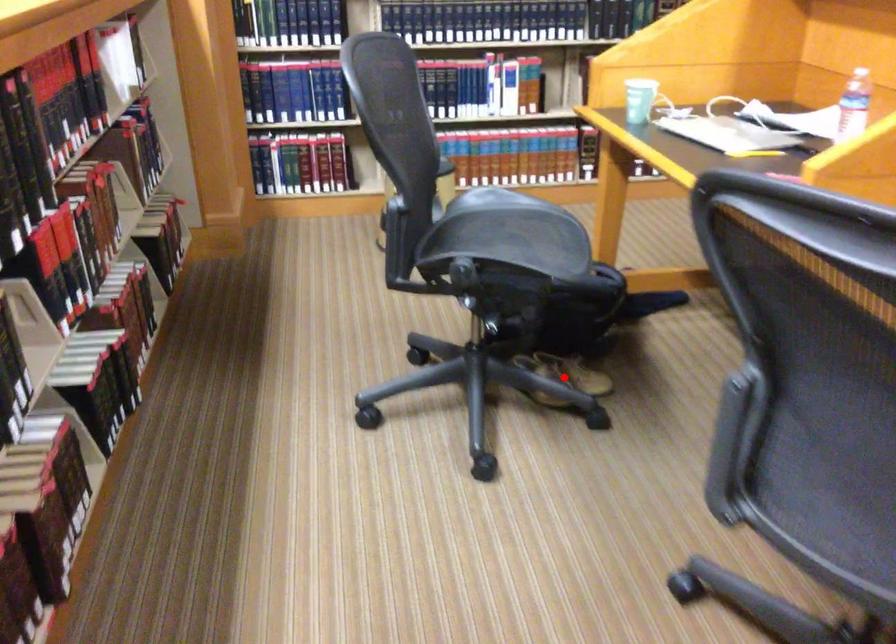
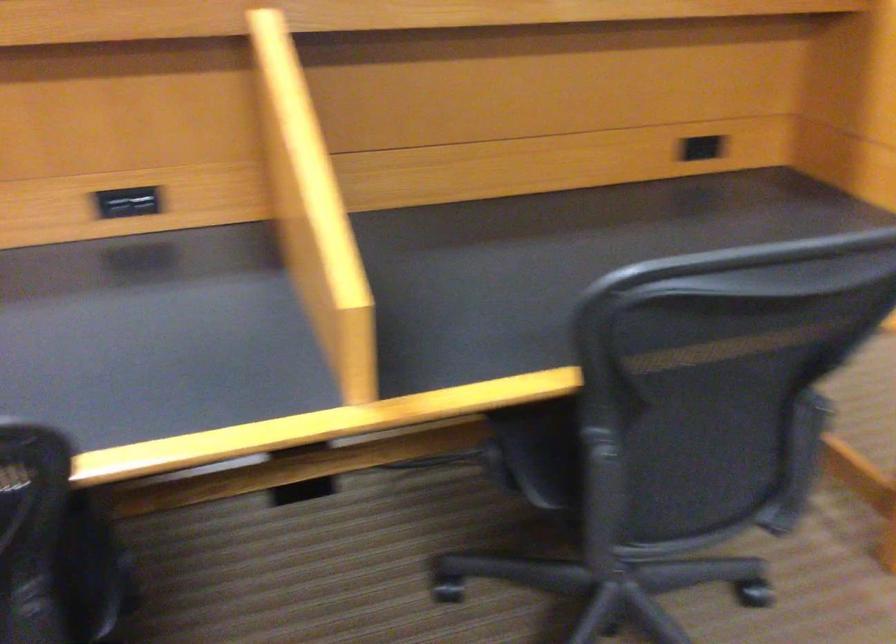
Question: I am providing you with two images of the same scene from different viewpoints. A red point is marked on the first image. Is the red point's position out of view in image 2?

Choices:
 (A) Yes
 (B) No

Answer: (A)